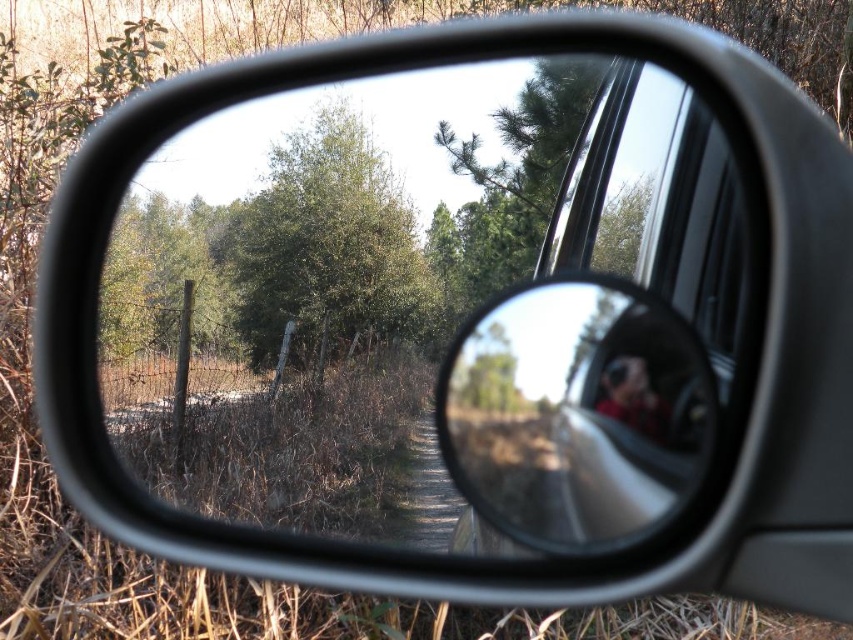
Question: Which point is closer to the camera taking this photo?

Choices:
 (A) (699, 348)
 (B) (317, 106)
 (C) (630, 385)

Answer: (A)

Question: Among these objects, which one is nearest to the camera?

Choices:
 (A) blurred fabric person at center
 (B) green leafy tree at center
 (C) glossy metallic mirror at center

Answer: (C)

Question: Can you confirm if glossy metallic mirror at center is positioned to the right of green leafy tree at center?

Choices:
 (A) yes
 (B) no

Answer: (A)

Question: Observing the image, what is the correct spatial positioning of green leafy tree at center in reference to blurred fabric person at center?

Choices:
 (A) below
 (B) above

Answer: (B)

Question: From the image, what is the correct spatial relationship of glossy metallic mirror at center in relation to green leafy tree at center?

Choices:
 (A) below
 (B) above

Answer: (A)

Question: Which object appears closest to the camera in this image?

Choices:
 (A) blurred fabric person at center
 (B) green leafy tree at center

Answer: (A)